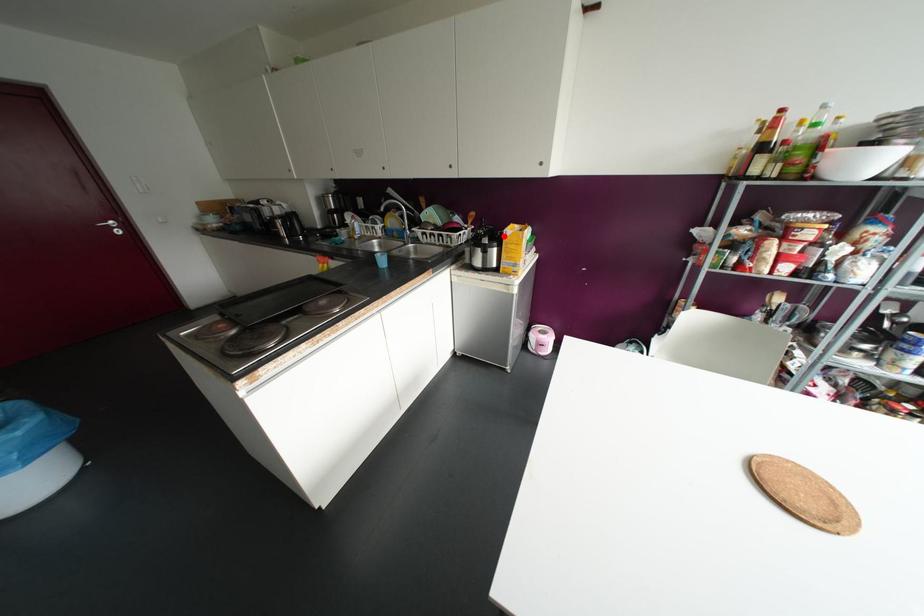
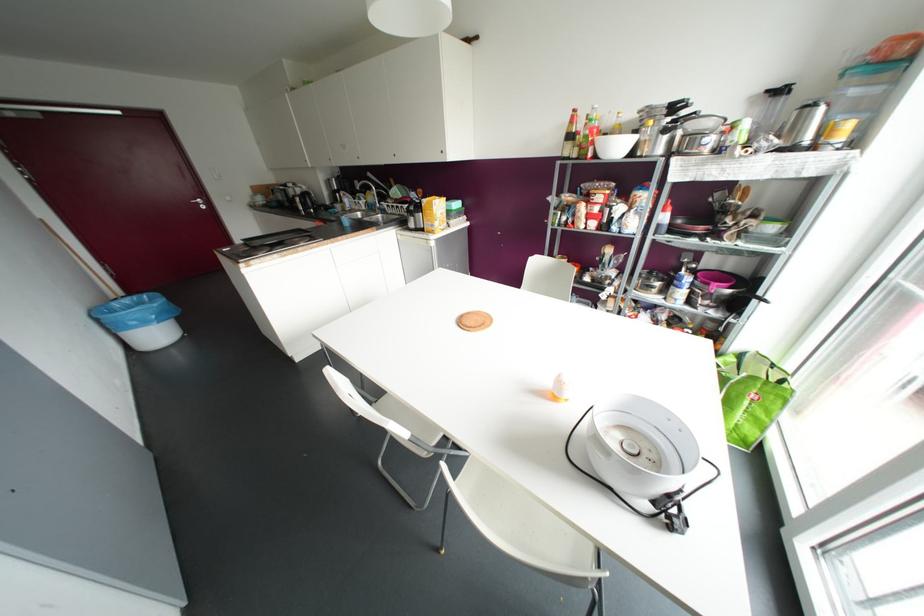
The point at the highlighted location is marked in the first image. Where is the corresponding point in the second image?

(421, 204)